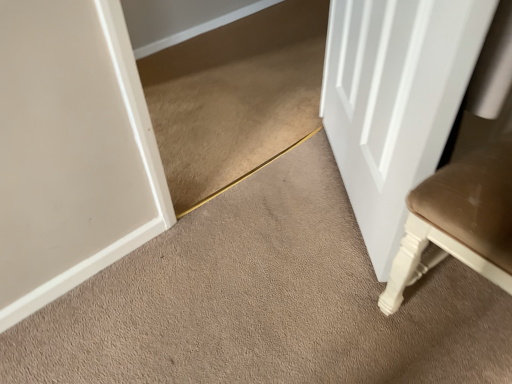
Identify the location of white glossy door at right. (395, 101).

What do you see at coordinates (395, 101) in the screenshot? This screenshot has width=512, height=384. I see `white glossy door at right` at bounding box center [395, 101].

Locate an element on the screen. This screenshot has width=512, height=384. white glossy door at right is located at coordinates (395, 101).